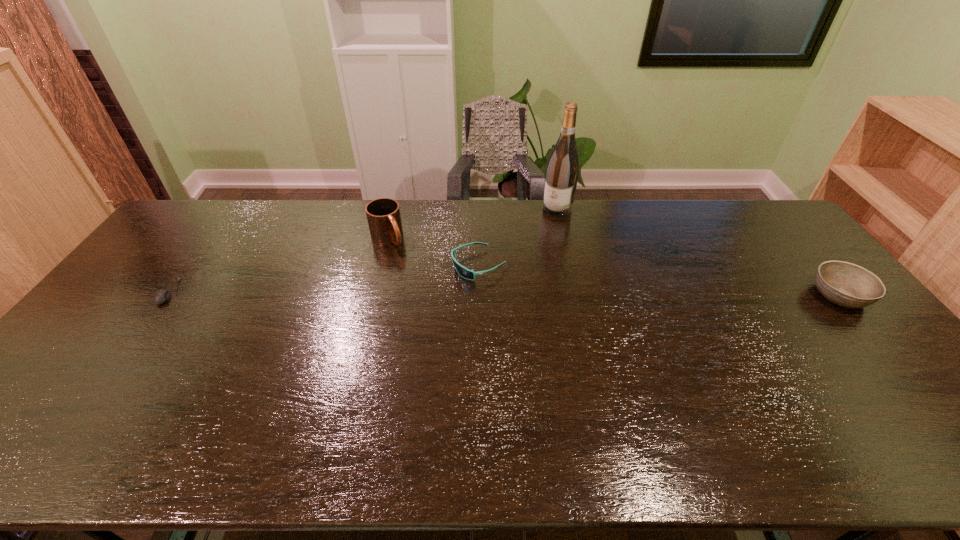
Identify the location of vacant spot on the desktop that is between the leftmost object and the rightmost object and is positioned on the front-facing side of the sunglasses. (411, 293).

You are a GUI agent. You are given a task and a screenshot of the screen. Output one action in this format:
    pyautogui.click(x=<x>, y=<y>)
    Task: Click on the free spot on the desktop that is between the leftmost object and the third tallest object and is positioned on the side of the mug with the handle
    
    Given the screenshot: What is the action you would take?
    pyautogui.click(x=435, y=293)

Locate an element on the screen. free space on the desktop that is between the shortest object and the rightmost object and is positioned on the label of the farthest object is located at coordinates (491, 293).